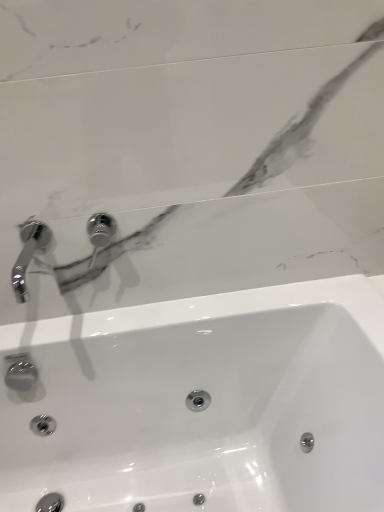
Question: Is point pyautogui.click(x=61, y=358) closer or farther from the camera than point pyautogui.click(x=29, y=223)?

Choices:
 (A) farther
 (B) closer

Answer: (A)

Question: In terms of size, does white glossy sink at center appear bigger or smaller than chrome metallic faucet at upper left, marked as the second tap in a right-to-left arrangement?

Choices:
 (A) big
 (B) small

Answer: (A)

Question: Based on their relative distances, which object is nearer to the polished chrome tap at upper center, positioned as the second tap in left-to-right order?

Choices:
 (A) white glossy sink at center
 (B) chrome metallic faucet at upper left, the first tap viewed from the left

Answer: (B)

Question: Which object is positioned closest to the white glossy sink at center?

Choices:
 (A) chrome metallic faucet at upper left, marked as the second tap in a right-to-left arrangement
 (B) polished chrome tap at upper center, the first tap from the right

Answer: (B)